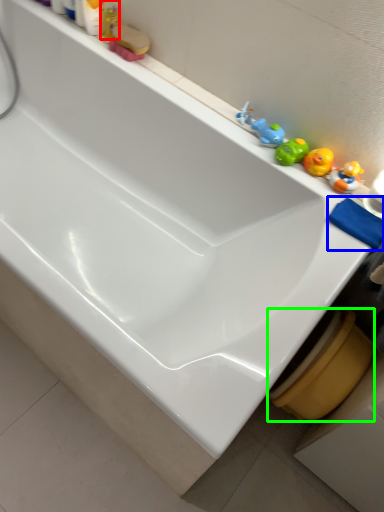
Question: Based on their relative distances, which object is nearer to toiletry (highlighted by a red box)? Choose from bath towel (highlighted by a blue box) and toilet bowl (highlighted by a green box).

Choices:
 (A) bath towel
 (B) toilet bowl

Answer: (A)